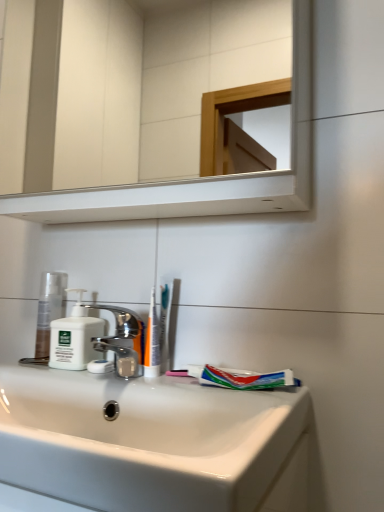
At what (x,y) coordinates should I click in order to perform the action: click on free space in front of matte white lotion at left. Please return your answer as a coordinate pair (x, y). This screenshot has height=512, width=384. Looking at the image, I should click on (44, 369).